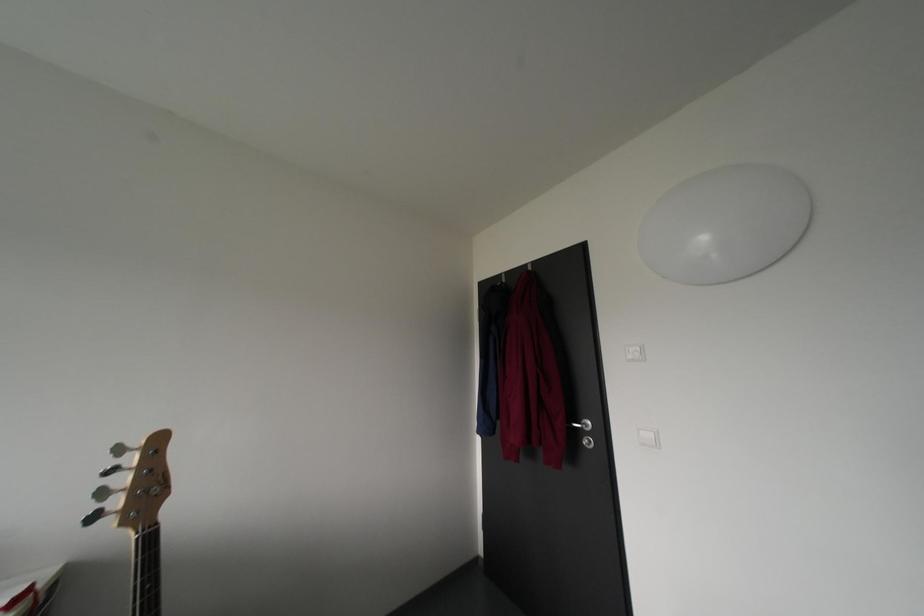
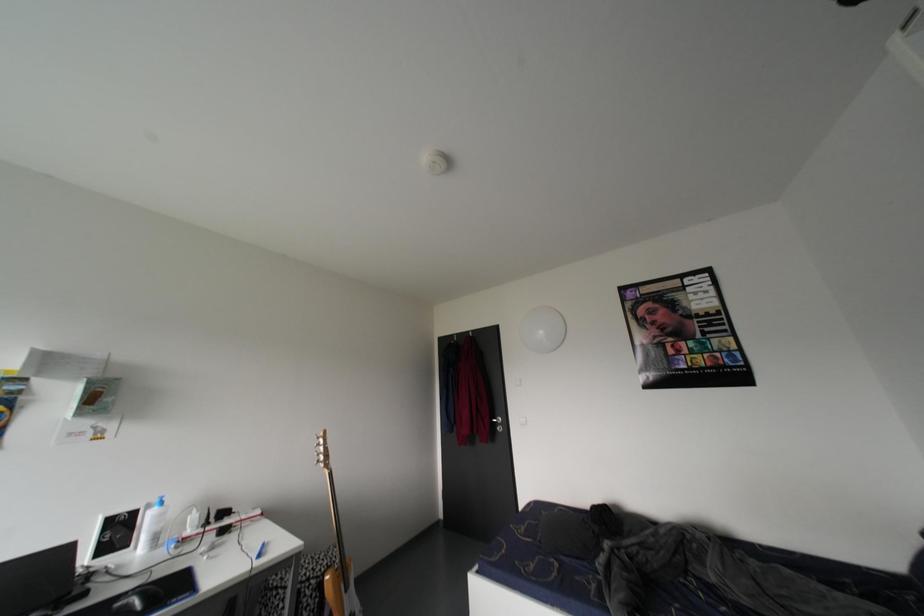
What movement of the cameraman would produce the second image?

The cameraman moved toward left, backward.